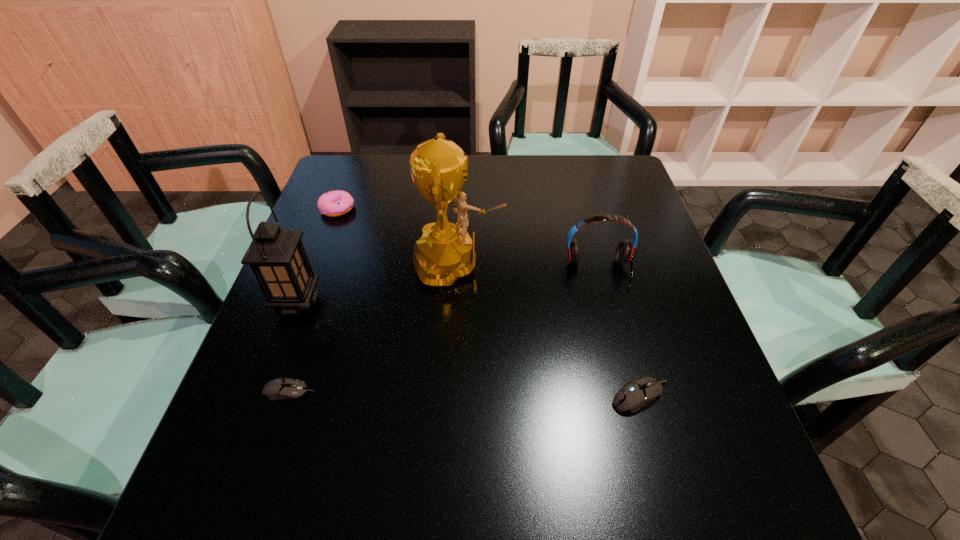
The height and width of the screenshot is (540, 960). I want to click on computer mouse that is at the right edge, so click(x=635, y=393).

Identify the location of headset located at the right edge. (624, 252).

Find the location of a particular element. object situated at the far left corner is located at coordinates (335, 203).

Where is `object that is at the near right corner`? object that is at the near right corner is located at coordinates (635, 393).

Find the location of a particular element. vacant position at the far edge of the desktop is located at coordinates (409, 173).

I want to click on free space at the left edge, so click(346, 305).

Locate an element on the screen. The image size is (960, 540). vacant region at the right edge of the desktop is located at coordinates (686, 341).

You are a GUI agent. You are given a task and a screenshot of the screen. Output one action in this format:
    pyautogui.click(x=<x>, y=<y>)
    Task: Click on the free location at the far left corner
    
    Given the screenshot: What is the action you would take?
    354,198

Identify the location of free region at the near left corner of the desktop. Image resolution: width=960 pixels, height=540 pixels. (304, 433).

In the image, there is a desktop. Identify the location of free space at the far right corner. (628, 165).